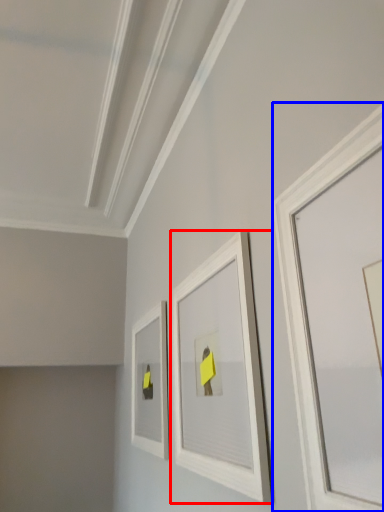
Question: Among these objects, which one is farthest to the camera, picture frame (highlighted by a red box) or picture frame (highlighted by a blue box)?

Choices:
 (A) picture frame
 (B) picture frame

Answer: (A)